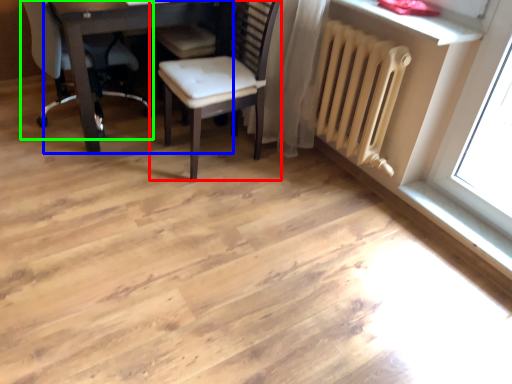
Question: Which is nearer to the chair (highlighted by a red box)? table (highlighted by a blue box) or chair (highlighted by a green box).

Choices:
 (A) table
 (B) chair

Answer: (A)